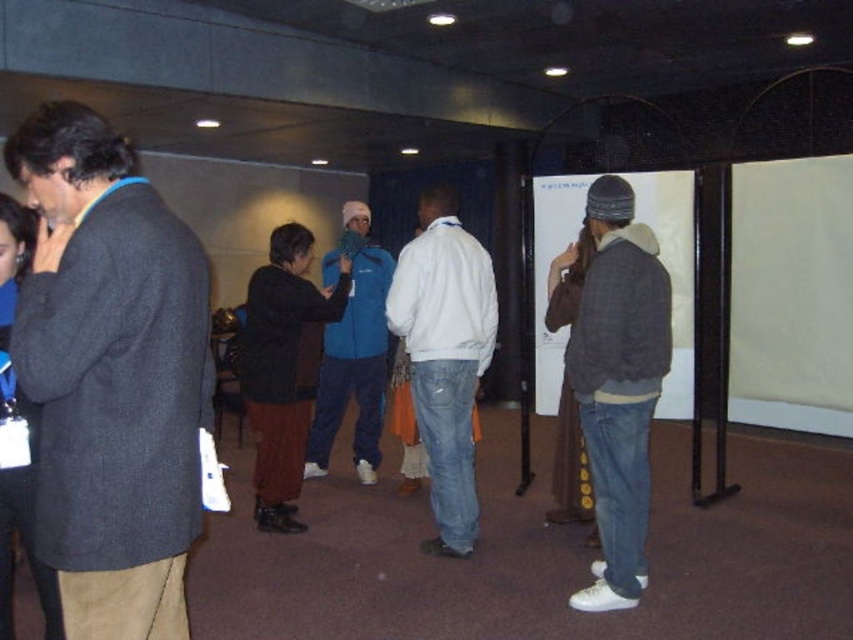
Question: Can you confirm if white matte jacket at center is positioned below white matte projection screen at center?

Choices:
 (A) yes
 (B) no

Answer: (A)

Question: Which point is farther to the camera?

Choices:
 (A) (643, 378)
 (B) (469, 480)

Answer: (B)

Question: Among these objects, which one is nearest to the camera?

Choices:
 (A) white matte projection screen at center
 (B) dark gray wool coat at left
 (C) dark gray knit hat at center
 (D) blue fleece jacket at center

Answer: (B)

Question: Where is white matte jacket at center located in relation to blue fleece jacket at center in the image?

Choices:
 (A) below
 (B) above

Answer: (A)

Question: Among these objects, which one is farthest from the camera?

Choices:
 (A) dark gray wool coat at left
 (B) white matte jacket at center

Answer: (B)

Question: Does white matte jacket at center lie behind white matte projection screen at center?

Choices:
 (A) no
 (B) yes

Answer: (A)